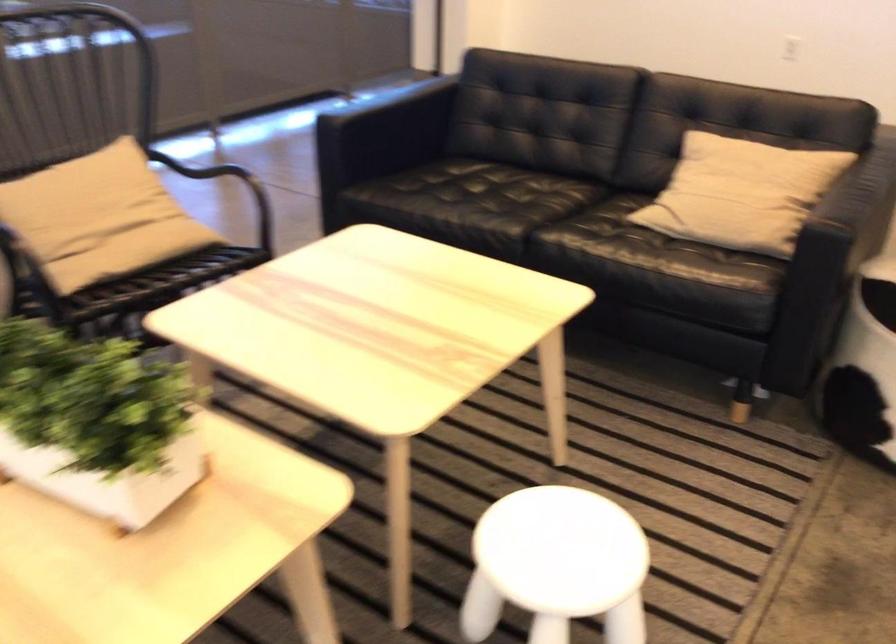
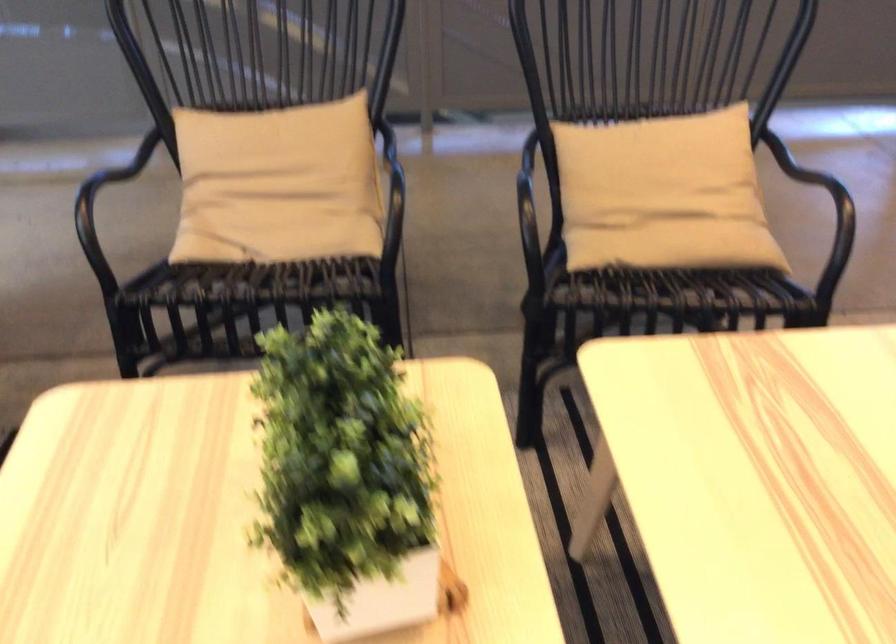
Find the pixel in the second image that matches (91,393) in the first image.

(346, 477)